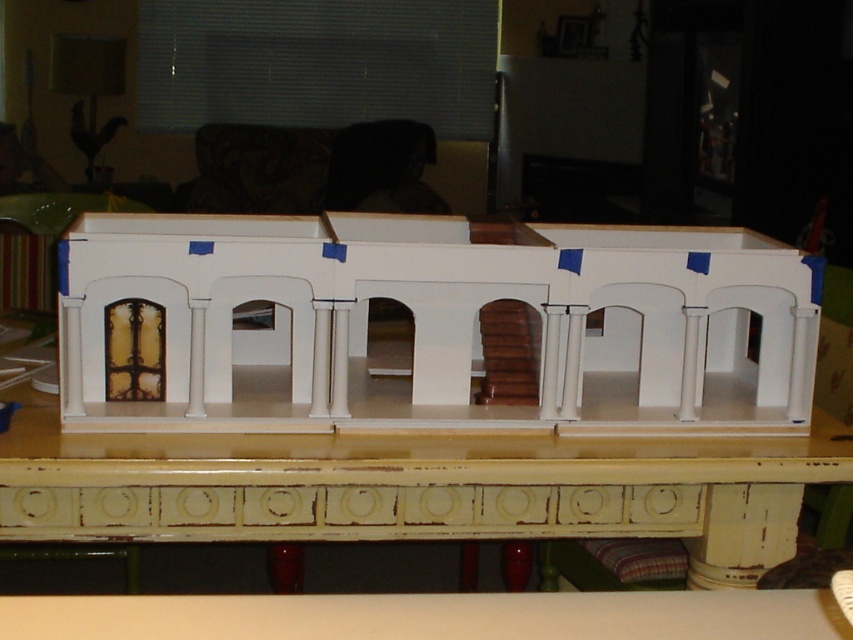
Question: Can you confirm if white matte building at center is positioned above white distressed wood table at center?

Choices:
 (A) no
 (B) yes

Answer: (B)

Question: Can you confirm if white matte building at center is positioned below white distressed wood table at center?

Choices:
 (A) yes
 (B) no

Answer: (B)

Question: Is white matte building at center bigger than white distressed wood table at center?

Choices:
 (A) yes
 (B) no

Answer: (A)